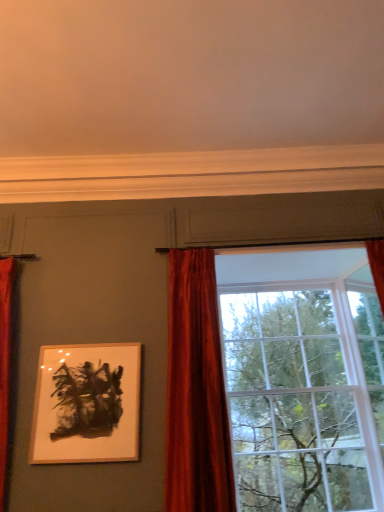
Locate an element on the screen. The image size is (384, 512). velvet red curtain at center is located at coordinates (196, 391).

At what (x,y) coordinates should I click in order to perform the action: click on glass window at center. Please return your answer as a coordinate pair (x, y). The image size is (384, 512). Looking at the image, I should click on (192, 394).

Describe the element at coordinates (192, 394) in the screenshot. I see `glass window at center` at that location.

Identify the location of wooden picture frame at upper left. (87, 404).

How different are the orientations of velvet red curtain at center and wooden picture frame at upper left in degrees?

0.0789 degrees.

The width and height of the screenshot is (384, 512). Find the location of `picture frame beneath the velvet red curtain at center (from a real-world perspective)`. picture frame beneath the velvet red curtain at center (from a real-world perspective) is located at coordinates (87, 404).

Based on the photo, which of these two, velvet red curtain at center or wooden picture frame at upper left, stands shorter?

wooden picture frame at upper left.

In the scene shown: Which of these two, velvet red curtain at center or wooden picture frame at upper left, is wider?

velvet red curtain at center.

Considering the relative sizes of wooden picture frame at upper left and glass window at center in the image provided, is wooden picture frame at upper left thinner than glass window at center?

Yes, wooden picture frame at upper left is thinner than glass window at center.

Which point is more distant from viewer, (87, 355) or (376, 275)?

The point (376, 275) is farther from the camera.

The image size is (384, 512). What are the coordinates of `picture frame that is below the glass window at center (from the image's perspective)` in the screenshot? It's located at (87, 404).

Can you tell me how much wooden picture frame at upper left and glass window at center differ in facing direction?

The facing directions of wooden picture frame at upper left and glass window at center are 0.614 degrees apart.

Considering the positions of point (204, 492) and point (136, 367), is point (204, 492) closer or farther from the camera than point (136, 367)?

Point (204, 492).

Looking at this image, who is more distant, glass window at center or wooden picture frame at upper left?

wooden picture frame at upper left is more distant.

From the image's perspective, which one is positioned higher, glass window at center or wooden picture frame at upper left?

From the image's view, glass window at center is above.

From the image's perspective, is velvet red curtain at center on glass window at center?

Yes, from the image's perspective, velvet red curtain at center is on top of glass window at center.

This screenshot has width=384, height=512. In order to click on window that is on the right side of velvet red curtain at center in this screenshot , I will do `click(192, 394)`.

Does velvet red curtain at center have a lesser height compared to glass window at center?

Correct, velvet red curtain at center is not as tall as glass window at center.

Between glass window at center and velvet red curtain at center, which one has smaller size?

velvet red curtain at center is smaller.

Is glass window at center far from velvet red curtain at center?

That's not correct — glass window at center is a little close to velvet red curtain at center.

In terms of height, does glass window at center look taller or shorter compared to velvet red curtain at center?

glass window at center is taller than velvet red curtain at center.

Is velvet red curtain at center at the back of glass window at center?

glass window at center does not have its back to velvet red curtain at center.

Does wooden picture frame at upper left turn towards velvet red curtain at center?

No, wooden picture frame at upper left is not oriented towards velvet red curtain at center.

Between wooden picture frame at upper left and velvet red curtain at center, which one has smaller size?

wooden picture frame at upper left.

Is wooden picture frame at upper left far away from velvet red curtain at center?

Actually, wooden picture frame at upper left and velvet red curtain at center are a little close together.

Locate an element on the screen. curtain on the right of wooden picture frame at upper left is located at coordinates (196, 391).

Where is `picture frame behind the glass window at center`? picture frame behind the glass window at center is located at coordinates (87, 404).

When comparing their distances from glass window at center, does velvet red curtain at center or wooden picture frame at upper left seem further?

wooden picture frame at upper left lies further to glass window at center than the other object.

Considering their positions, is velvet red curtain at center positioned closer to wooden picture frame at upper left than glass window at center?

velvet red curtain at center is positioned closer to the anchor wooden picture frame at upper left.

Looking at this image, looking at the image, which one is located closer to glass window at center, wooden picture frame at upper left or velvet red curtain at center?

Among the two, velvet red curtain at center is located nearer to glass window at center.

When comparing their distances from velvet red curtain at center, does glass window at center or wooden picture frame at upper left seem closer?

Based on the image, glass window at center appears to be nearer to velvet red curtain at center.

Considering their positions, is glass window at center positioned further to wooden picture frame at upper left than velvet red curtain at center?

glass window at center is further to wooden picture frame at upper left.

Estimate the real-world distances between objects in this image. Which object is closer to velvet red curtain at center, wooden picture frame at upper left or glass window at center?

glass window at center lies closer to velvet red curtain at center than the other object.

Locate an element on the screen. curtain between wooden picture frame at upper left and glass window at center is located at coordinates (196, 391).